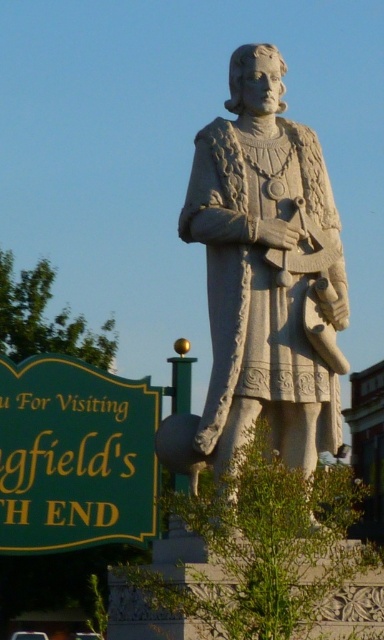
You are a tour guide leading a group to the white stone statue at center. As you approach, you notice the green painted wood sign at lower left. Which direction should you turn to face the statue from the sign?

To face the white stone statue at center from the green painted wood sign at lower left, you should turn to your right since the white stone statue at center is positioned on the right side of the green painted wood sign at lower left.

You are standing in front of the statue and want to determine the relative positions of two points marked on the statue. Which point, point at (301, 220) or point at (76, 410), is closer to your current position?

Point at (301, 220) is closer to the camera than point at (76, 410), so it is closer to your current position.